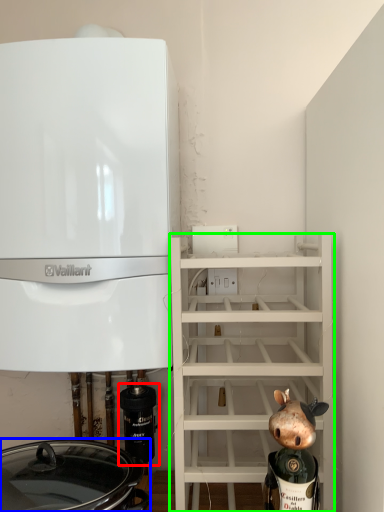
Question: Which object is positioned farthest from appliance (highlighted by a red box)? Select from crock pot (highlighted by a blue box) and shelf (highlighted by a green box).

Choices:
 (A) crock pot
 (B) shelf

Answer: (B)